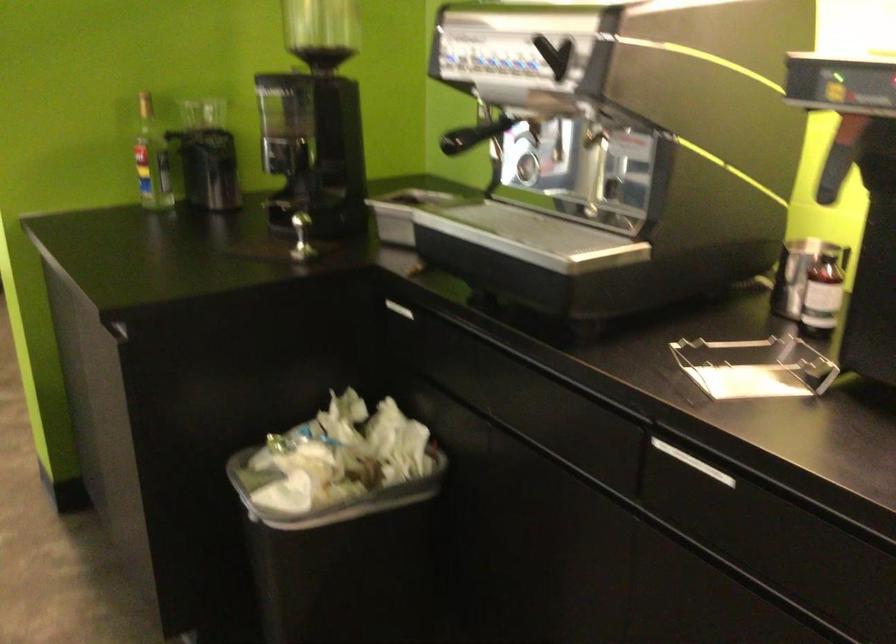
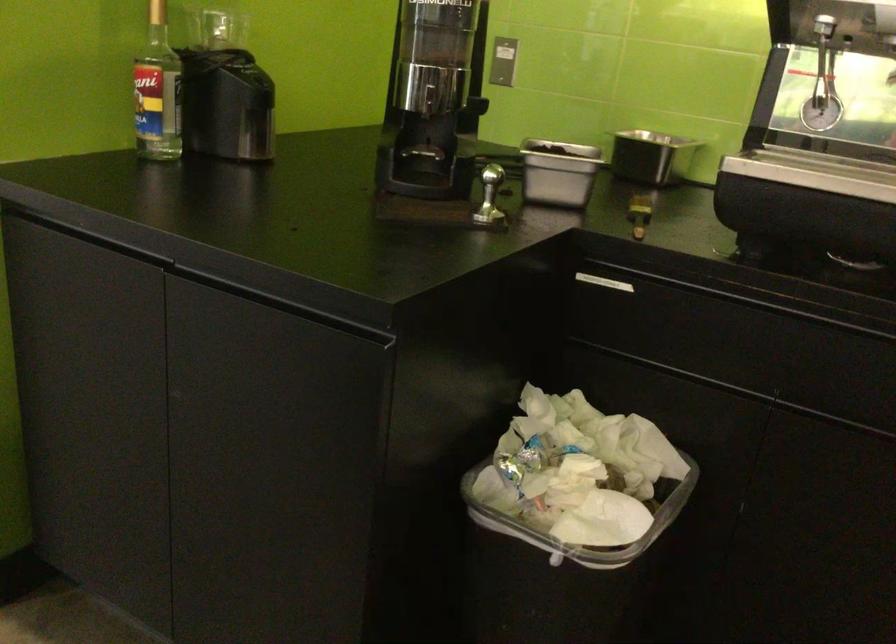
Where in the second image is the point corresponding to (x=104, y=308) from the first image?

(280, 304)